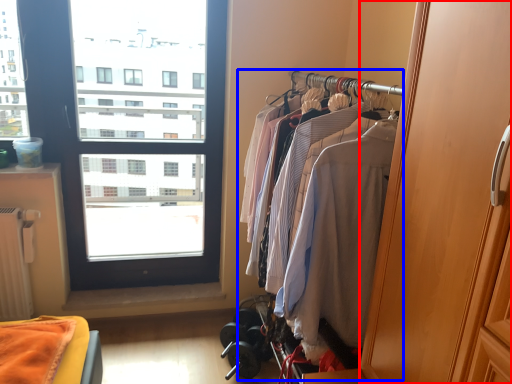
Question: Which of the following is the closest to the observer, screen door (highlighted by a red box) or closet (highlighted by a blue box)?

Choices:
 (A) screen door
 (B) closet

Answer: (A)